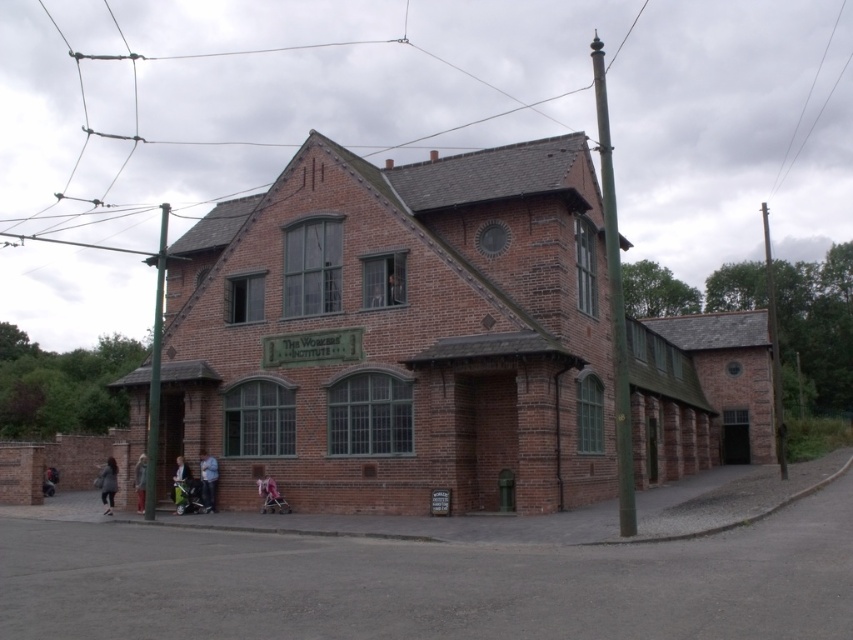
Identify the location of brown wooden pole at right. (775, 352).

The image size is (853, 640). Identify the location of brown wooden pole at right. (775, 352).

Between metallic wire at upper right and light brown leather jacket at lower center, which one appears on the left side from the viewer's perspective?

From the viewer's perspective, light brown leather jacket at lower center appears more on the left side.

Is point (839, 13) more distant than point (206, 486)?

That is True.

Where is `metallic wire at upper right`? This screenshot has height=640, width=853. metallic wire at upper right is located at coordinates (805, 100).

Between point (161, 296) and point (776, 182), which one is positioned in front?

Point (161, 296) is more forward.

Who is positioned more to the left, green metallic pole at left or metallic wire at upper right?

From the viewer's perspective, green metallic pole at left appears more on the left side.

This screenshot has height=640, width=853. What do you see at coordinates (155, 369) in the screenshot? I see `green metallic pole at left` at bounding box center [155, 369].

Find the location of `green metallic pole at left`. green metallic pole at left is located at coordinates (155, 369).